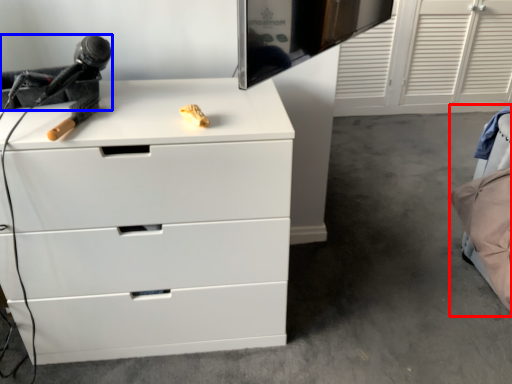
Question: Which of the following is the farthest to the observer, bed (highlighted by a red box) or equipment (highlighted by a blue box)?

Choices:
 (A) bed
 (B) equipment

Answer: (A)